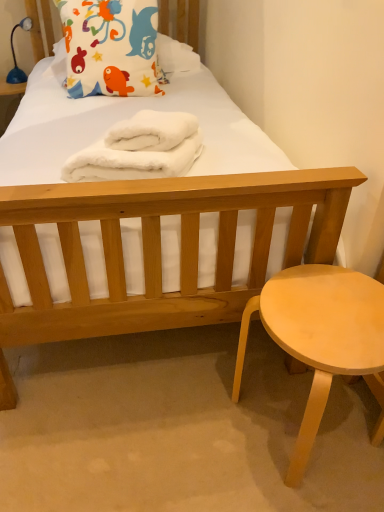
Question: Is white fluffy towels at center inside or outside of light wood stool at lower right?

Choices:
 (A) outside
 (B) inside

Answer: (A)

Question: Does point (115, 179) appear closer or farther from the camera than point (319, 288)?

Choices:
 (A) closer
 (B) farther

Answer: (A)

Question: Which of these objects is positioned farthest from the light wood stool at lower right?

Choices:
 (A) fluffy cotton pillow at upper left
 (B) blue plastic lamp at upper left
 (C) white fluffy towels at center

Answer: (B)

Question: Estimate the real-world distances between objects in this image. Which object is closer to the white fluffy towels at center?

Choices:
 (A) blue plastic lamp at upper left
 (B) light wood stool at lower right
 (C) fluffy cotton pillow at upper left

Answer: (B)